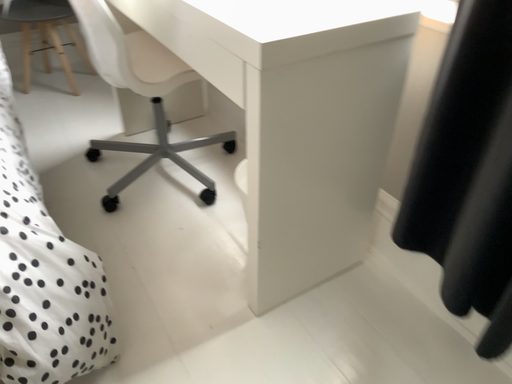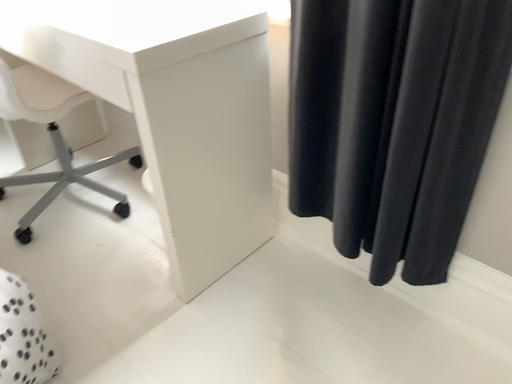
Question: Which way did the camera rotate in the video?

Choices:
 (A) rotated left
 (B) rotated right

Answer: (B)